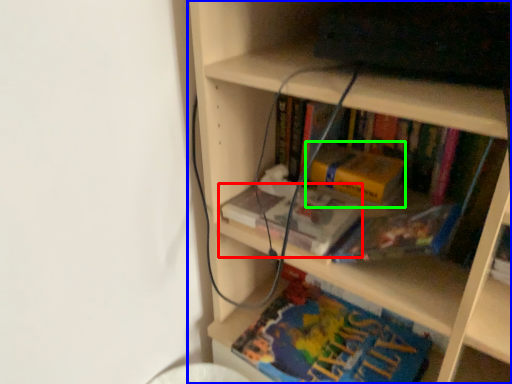
Question: Which is farther away from book (highlighted by a red box)? bookcase (highlighted by a blue box) or paperback book (highlighted by a green box)?

Choices:
 (A) bookcase
 (B) paperback book

Answer: (A)